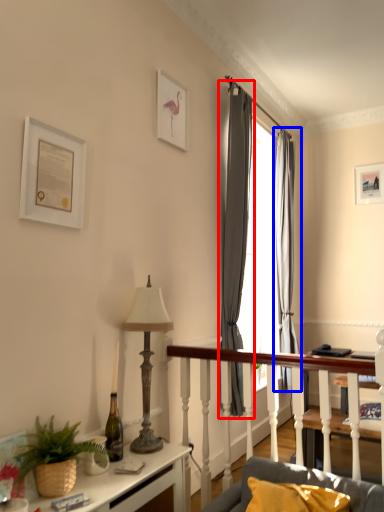
Question: Which of the following is the closest to the observer, curtain (highlighted by a red box) or curtain (highlighted by a blue box)?

Choices:
 (A) curtain
 (B) curtain

Answer: (A)